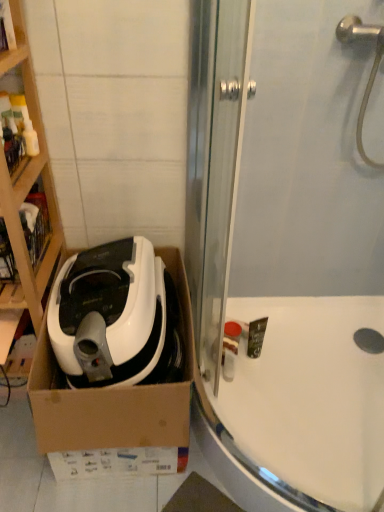
Question: Which is correct: white cardboard box at left is inside white matte/soft plastic at left, or outside of it?

Choices:
 (A) inside
 (B) outside

Answer: (B)

Question: Looking at the image, does white cardboard box at left seem bigger or smaller compared to white matte/soft plastic at left?

Choices:
 (A) big
 (B) small

Answer: (A)

Question: Estimate the real-world distances between objects in this image. Which object is farther from the transparent glass shower door at upper center?

Choices:
 (A) white matte/soft plastic at left
 (B) white glossy bathtub at lower right
 (C) white cardboard box at left

Answer: (C)

Question: Estimate the real-world distances between objects in this image. Which object is closer to the white glossy bathtub at lower right?

Choices:
 (A) white cardboard box at left
 (B) transparent glass shower door at upper center
 (C) white matte/soft plastic at left

Answer: (B)